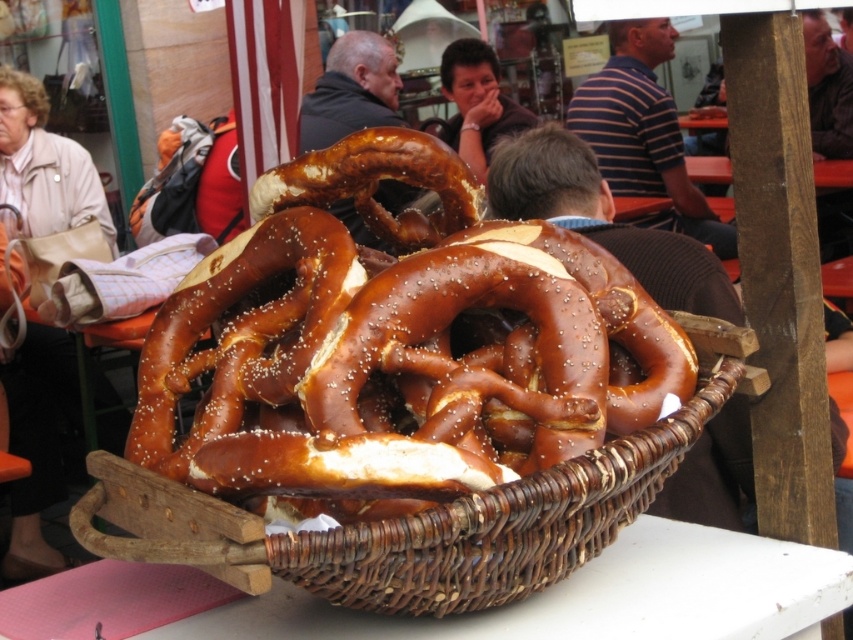
Does beige leather handbag at left have a greater width compared to smooth brown hair at upper center?

Yes.

Is point (51, 134) farther from viewer compared to point (451, 124)?

No.

Which is in front, point (47, 150) or point (461, 60)?

Point (47, 150) is more forward.

Identify the location of beige leather handbag at left. This screenshot has width=853, height=640. (38, 442).

Can you confirm if brown woven basket at center is wider than brown wicker basket at center?

In fact, brown woven basket at center might be narrower than brown wicker basket at center.

Does brown woven basket at center appear on the right side of brown wicker basket at center?

Correct, you'll find brown woven basket at center to the right of brown wicker basket at center.

At what (x,y) coordinates should I click in order to perform the action: click on brown woven basket at center. Please return your answer as a coordinate pair (x, y). The image size is (853, 640). Looking at the image, I should click on (426, 516).

Who is more forward, (778,593) or (473,147)?

Point (778,593) is more forward.

What do you see at coordinates (595, 595) in the screenshot?
I see `brown wicker basket at center` at bounding box center [595, 595].

I want to click on brown wicker basket at center, so click(595, 595).